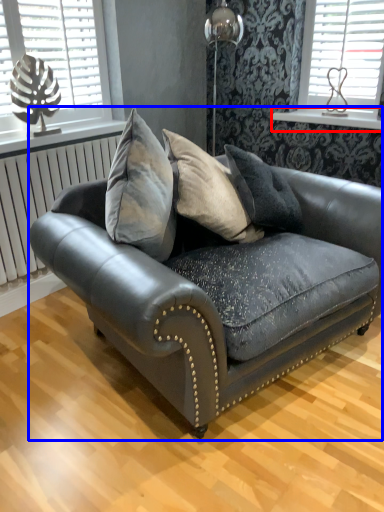
Question: Among these objects, which one is farthest to the camera, window sill (highlighted by a red box) or studio couch (highlighted by a blue box)?

Choices:
 (A) window sill
 (B) studio couch

Answer: (A)